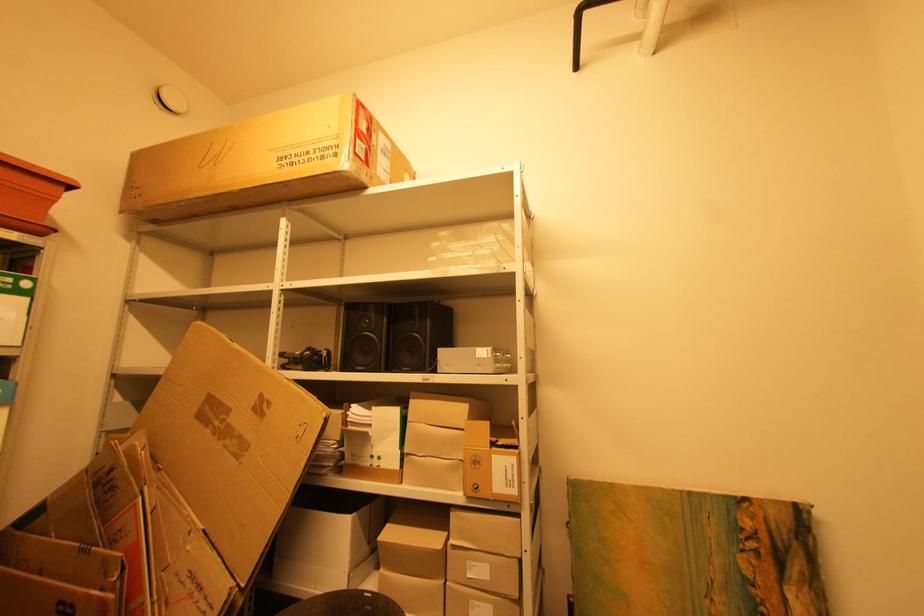
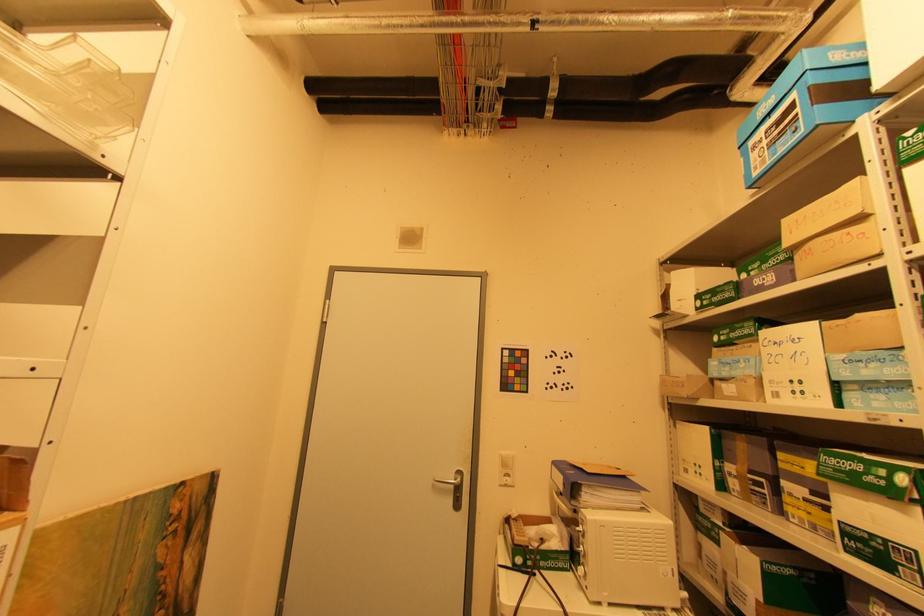
Question: The images are taken continuously from a first-person perspective. In which direction is your viewpoint rotating?

Choices:
 (A) Left
 (B) Right
 (C) Up
 (D) Down

Answer: (B)